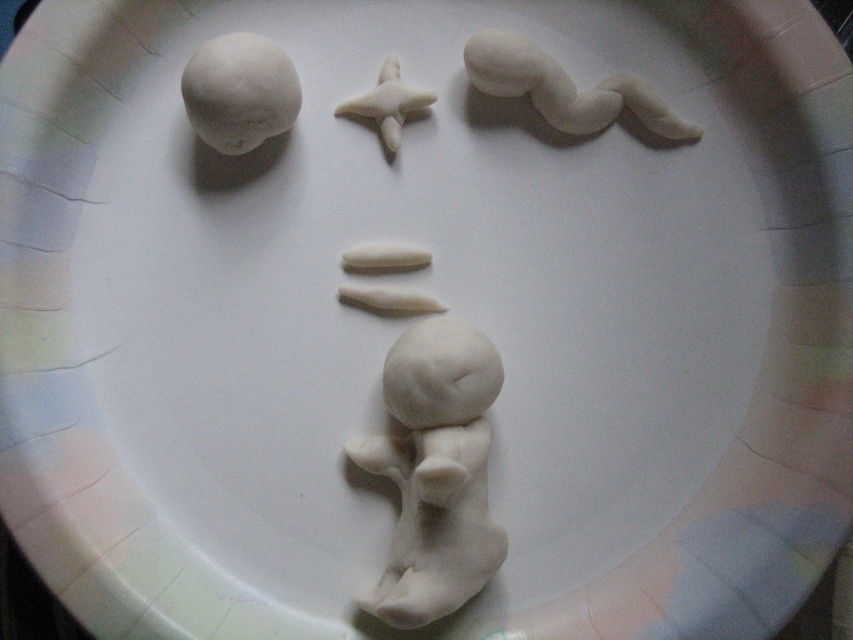
Does point (375, 596) lie behind point (225, 118)?

No, (375, 596) is closer to viewer.

Does point (460, 426) come in front of point (196, 52)?

Yes, it is in front of point (196, 52).

What do you see at coordinates (434, 472) in the screenshot? I see `white clay figure at center` at bounding box center [434, 472].

Locate an element on the screen. The height and width of the screenshot is (640, 853). white clay figure at center is located at coordinates (434, 472).

Can you confirm if white clay figure at center is wider than white matte cylinder at center?

Yes.

You are a GUI agent. You are given a task and a screenshot of the screen. Output one action in this format:
    pyautogui.click(x=<x>, y=<y>)
    Task: Click on the white clay figure at center
    The width and height of the screenshot is (853, 640).
    Given the screenshot: What is the action you would take?
    pyautogui.click(x=434, y=472)

Is point (436, 451) more distant than point (369, 244)?

No, it is in front of (369, 244).

Locate an element on the screen. Image resolution: width=853 pixels, height=640 pixels. white clay figure at center is located at coordinates (434, 472).

Does white clay figure at center have a greater width compared to white clay shark fin at upper center?

Indeed, white clay figure at center has a greater width compared to white clay shark fin at upper center.

Is white clay figure at center behind white clay shark fin at upper center?

That is False.

At what (x,y) coordinates should I click in order to perform the action: click on white clay figure at center. Please return your answer as a coordinate pair (x, y). Looking at the image, I should click on (434, 472).